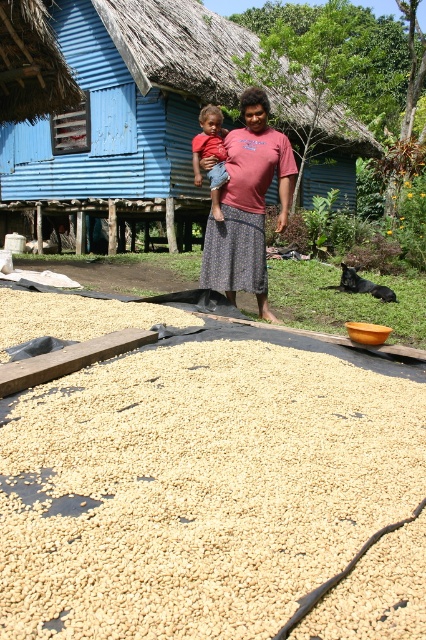
Is light brown gravel at lower center below matte pink shirt at center?

Indeed, light brown gravel at lower center is positioned under matte pink shirt at center.

Does light brown gravel at lower center have a smaller size compared to matte pink shirt at center?

No, light brown gravel at lower center is not smaller than matte pink shirt at center.

What are the coordinates of `light brown gravel at lower center` in the screenshot? It's located at (196, 490).

Between blue corrugated metal hut at upper left and light brown denim shorts at center, which one is positioned higher?

blue corrugated metal hut at upper left

The height and width of the screenshot is (640, 426). I want to click on blue corrugated metal hut at upper left, so click(126, 106).

Where is `blue corrugated metal hut at upper left`? The width and height of the screenshot is (426, 640). blue corrugated metal hut at upper left is located at coordinates (126, 106).

Is point (34, 464) more distant than point (169, 36)?

That is False.

Who is positioned more to the left, light brown gravel at lower center or blue corrugated metal hut at upper left?

From the viewer's perspective, blue corrugated metal hut at upper left appears more on the left side.

Measure the distance between light brown gravel at lower center and camera.

light brown gravel at lower center is 1.37 meters from camera.

The image size is (426, 640). Find the location of `light brown gravel at lower center`. light brown gravel at lower center is located at coordinates (196, 490).